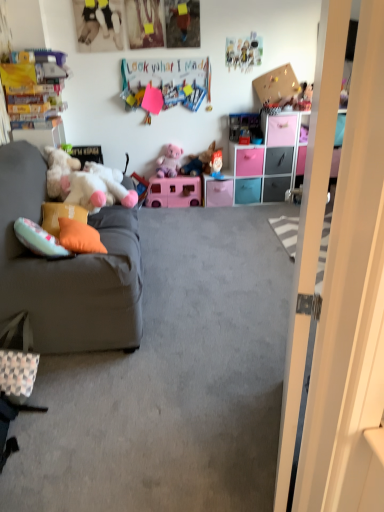
Find the location of `free space to the right of velvet gray couch at left`. free space to the right of velvet gray couch at left is located at coordinates (213, 284).